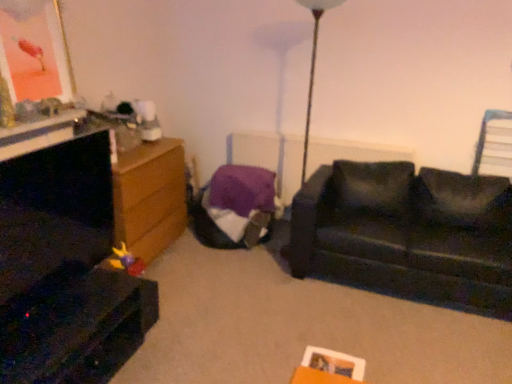
Locate an element on the screen. vacant space in dark wood entertainment center at left (from a real-world perspective) is located at coordinates (78, 281).